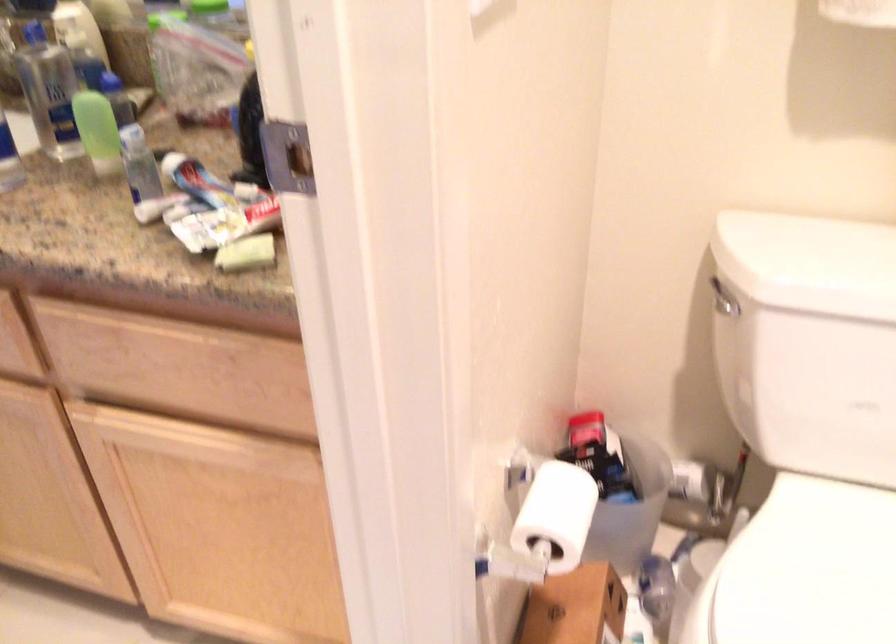
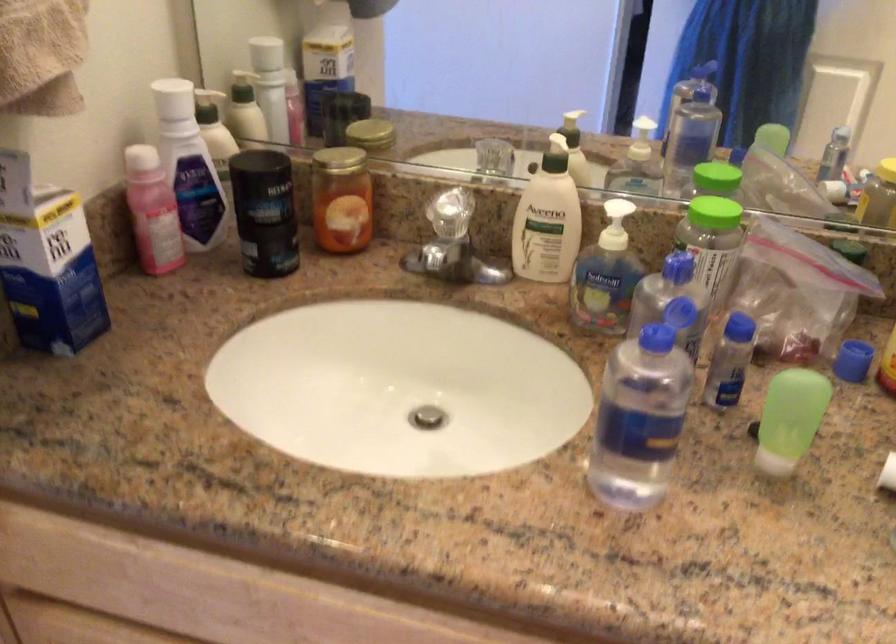
Find the pixel in the second image that matches (x=108, y=126) in the first image.

(789, 419)